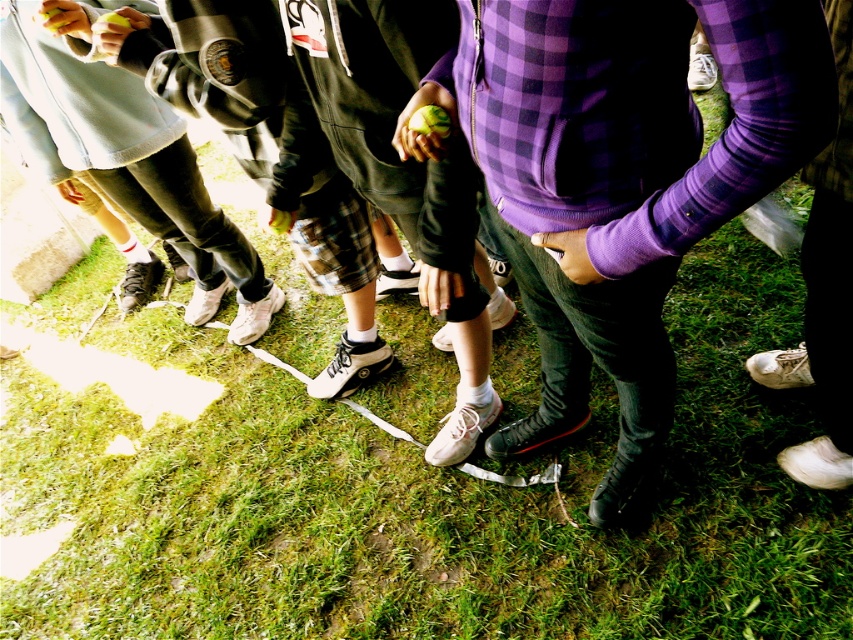
The image size is (853, 640). What do you see at coordinates (616, 179) in the screenshot?
I see `purple checkered hoodie at center` at bounding box center [616, 179].

Is purple checkered hoodie at center to the left of light blue fleece jacket at lower left from the viewer's perspective?

In fact, purple checkered hoodie at center is to the right of light blue fleece jacket at lower left.

Between point (781, 113) and point (28, 154), which one is positioned in front?

Point (781, 113)

Find the location of a particular element. Image resolution: width=853 pixels, height=640 pixels. purple checkered hoodie at center is located at coordinates (616, 179).

Identify the location of purple checkered hoodie at center. This screenshot has height=640, width=853. (616, 179).

Can you confirm if purple checkered hoodie at center is positioned below white leather shoe at lower right?

Correct, purple checkered hoodie at center is located below white leather shoe at lower right.

This screenshot has width=853, height=640. Identify the location of purple checkered hoodie at center. (616, 179).

Who is shorter, light blue fleece jacket at lower left or white leather shoe at lower right?

Standing shorter between the two is white leather shoe at lower right.

Is light blue fleece jacket at lower left to the right of white leather shoe at lower right from the viewer's perspective?

No, light blue fleece jacket at lower left is not to the right of white leather shoe at lower right.

The image size is (853, 640). What do you see at coordinates (125, 152) in the screenshot? I see `light blue fleece jacket at lower left` at bounding box center [125, 152].

The height and width of the screenshot is (640, 853). What are the coordinates of `light blue fleece jacket at lower left` in the screenshot? It's located at (125, 152).